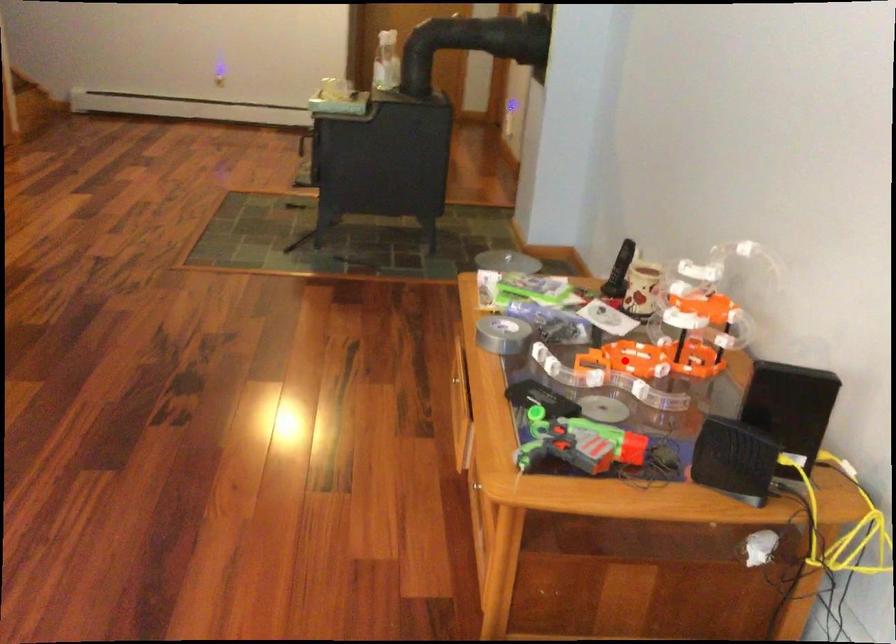
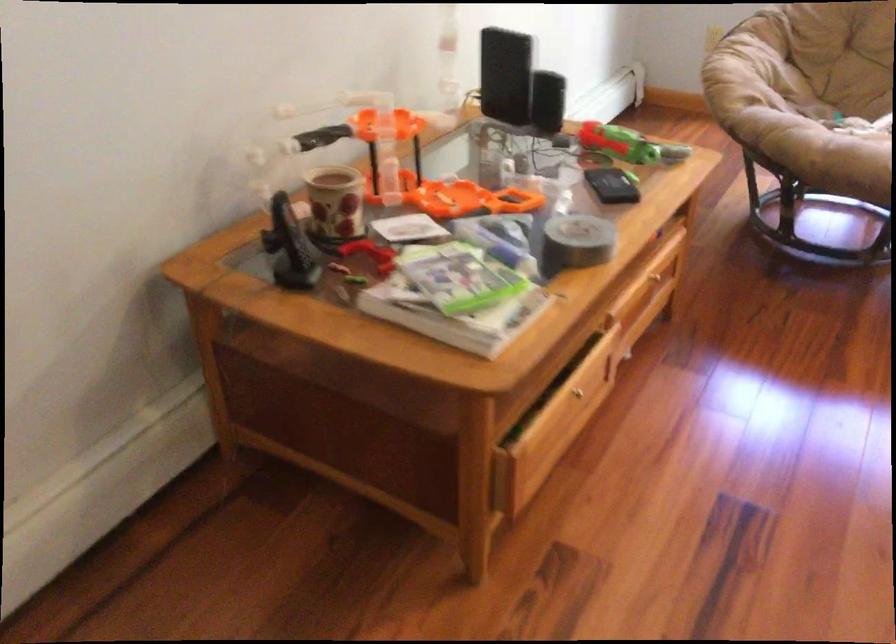
Question: I am providing you with two images of the same scene from different viewpoints. In image1, a red point is highlighted. Considering the same 3D point in image2, which of the following is correct?

Choices:
 (A) It is closer
 (B) It is farther

Answer: (A)